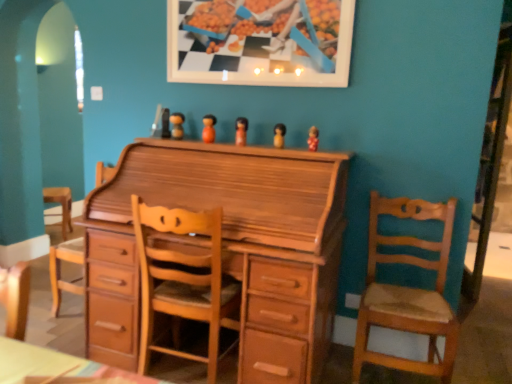
Identify the location of vacant space to the left of brown wooden figurine at center, which is the second toy in right-to-left order. The image size is (512, 384). (244, 147).